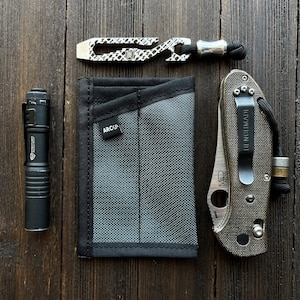
Where is `wooden surface`? Image resolution: width=300 pixels, height=300 pixels. wooden surface is located at coordinates [85, 271].